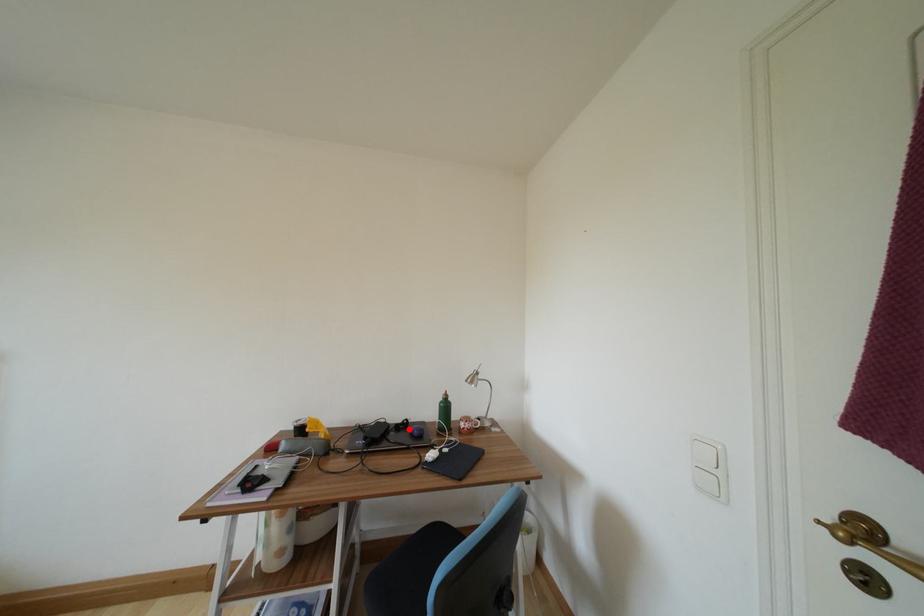
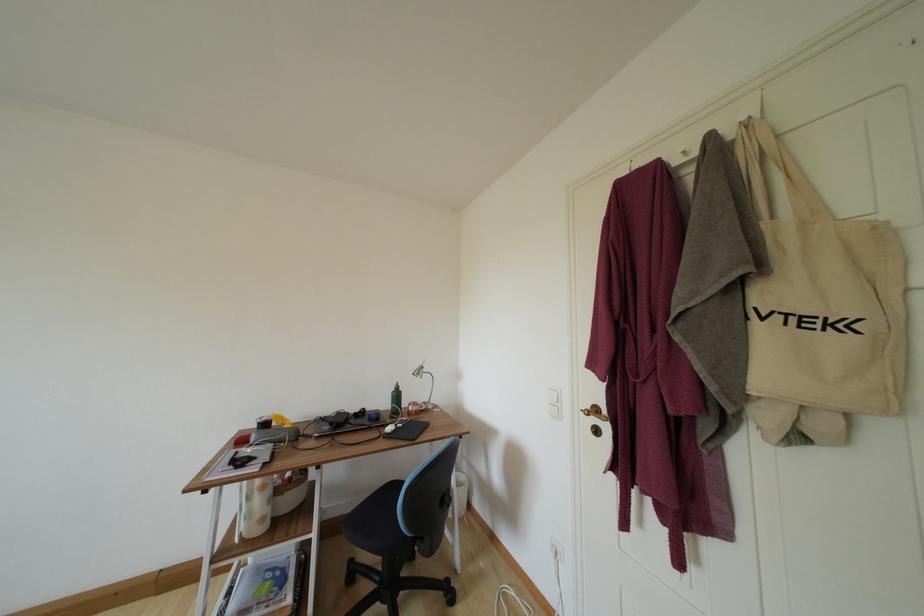
Where in the second image is the point corresponding to the highlighted location from the first image?

(367, 416)